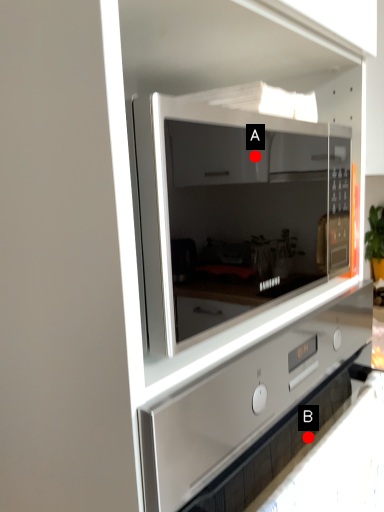
Question: Two points are circled on the image, labeled by A and B beside each circle. Which point is closer to the camera?

Choices:
 (A) A is closer
 (B) B is closer

Answer: (B)